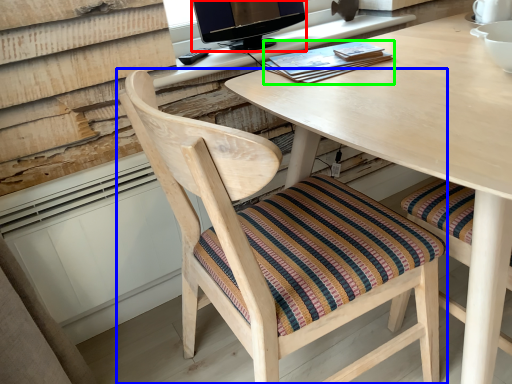
Question: Which is farther away from television (highlighted by a red box)? chair (highlighted by a blue box) or book (highlighted by a green box)?

Choices:
 (A) chair
 (B) book

Answer: (A)